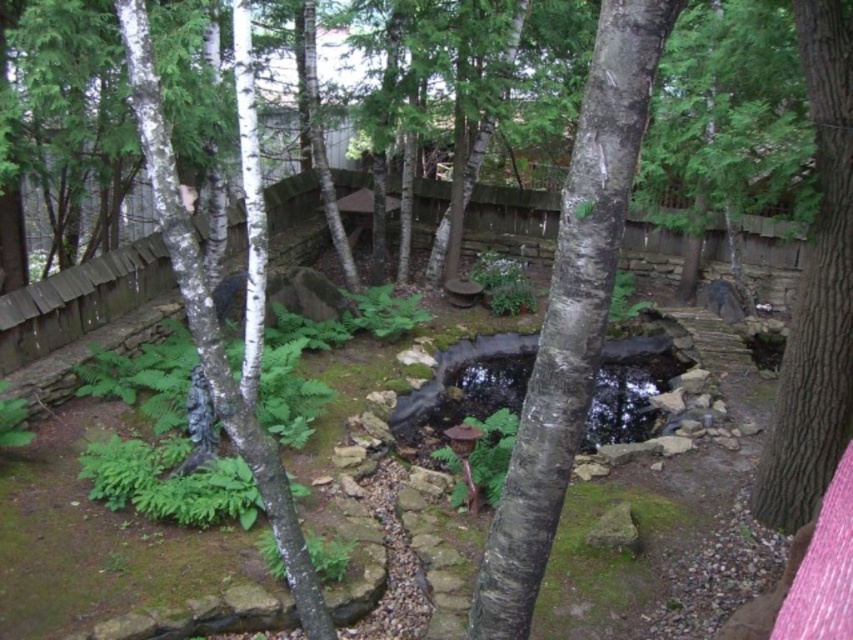
You are standing in the backyard garden and want to place a bench between the white smooth tree trunk at center and the brown rough bark tree trunk at right. Based on their positions, which tree trunk is closer to the ground where you are standing?

The white smooth tree trunk at center is positioned under the brown rough bark tree trunk at right, so the white smooth tree trunk at center is closer to the ground where you are standing.

You are standing in the backyard garden scene described. You want to place a small decorative fountain exactly at point (572,314). However, there is already an object there. What object is blocking the placement of the fountain at that point?

The point (572,314) is occupied by the white smooth tree trunk at center, so placing the fountain there would interfere with the existing tree trunk.